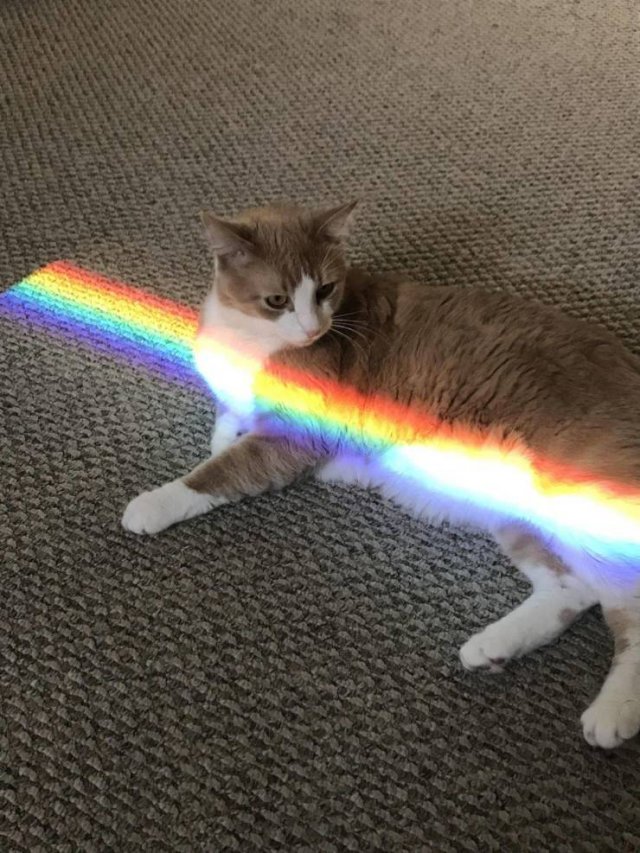
Where is `carpet`? The image size is (640, 853). carpet is located at coordinates (235, 675).